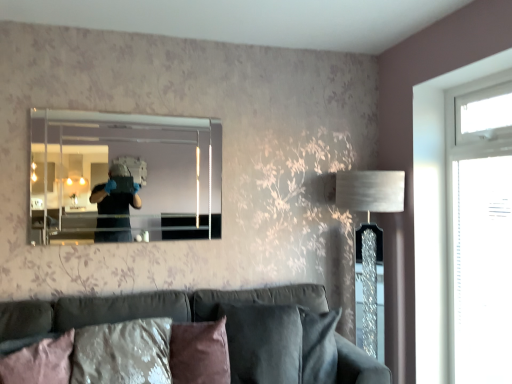
Identify the location of free space above clear glass mirror at upper center (from a real-world perspective). [x=131, y=107].